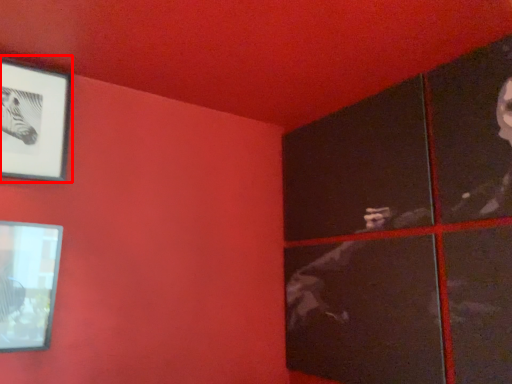
Question: From the image, what is the correct spatial relationship of picture frame (annotated by the red box) in relation to picture frame?

Choices:
 (A) left
 (B) right

Answer: (A)